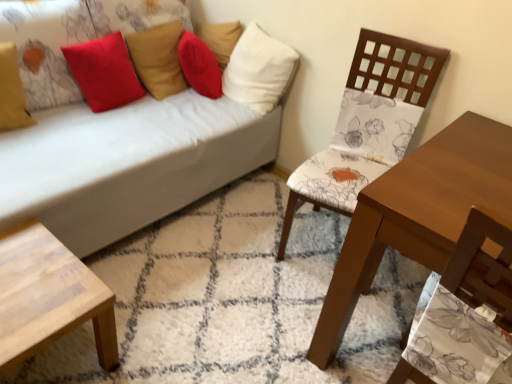
I want to click on vacant area that lies between light wood/texture coffee table at lower left and floral fabric chair at center right, so [214, 291].